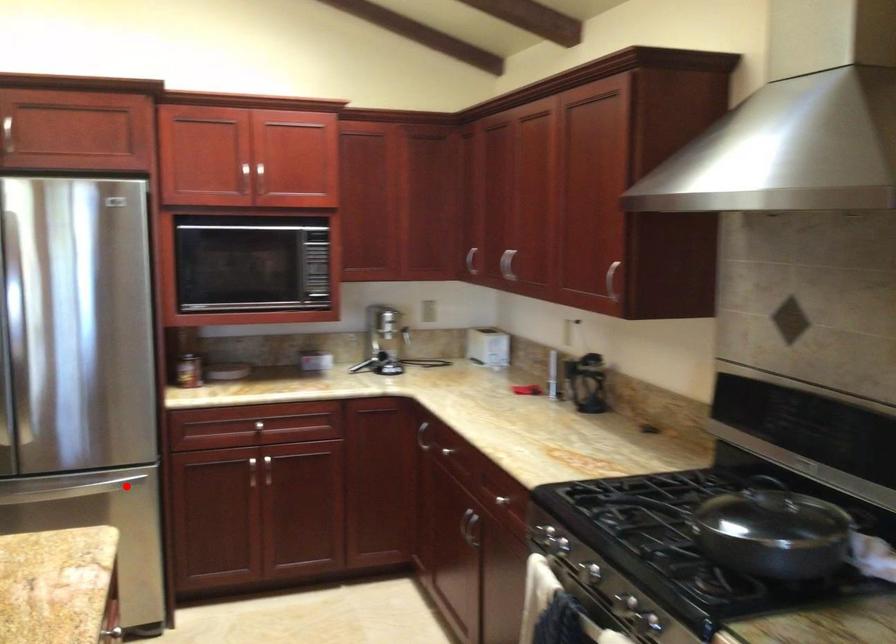
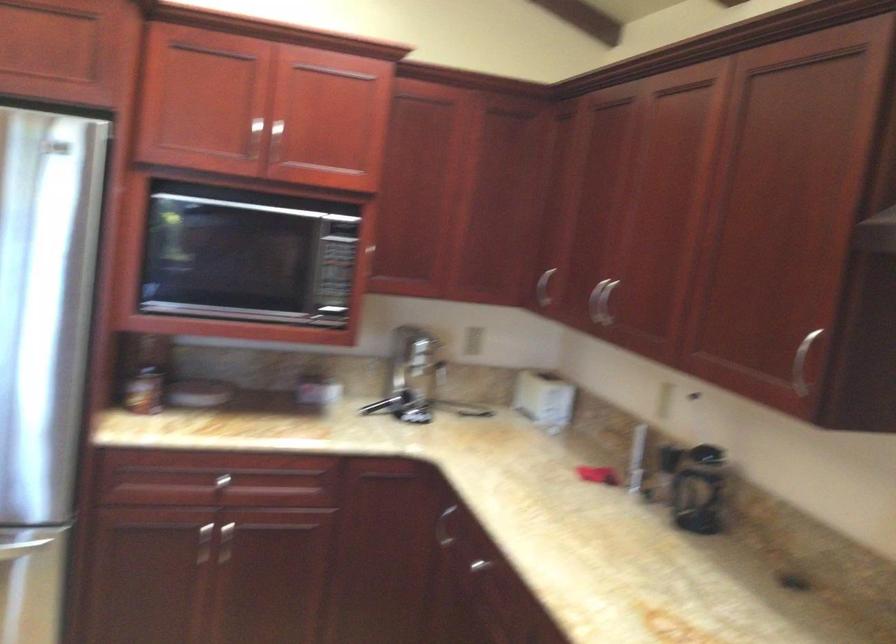
Question: I am providing you with two images of the same scene from different viewpoints. In image1, a red point is highlighted. Considering the same 3D point in image2, which of the following is correct?

Choices:
 (A) It is closer
 (B) It is farther

Answer: (A)